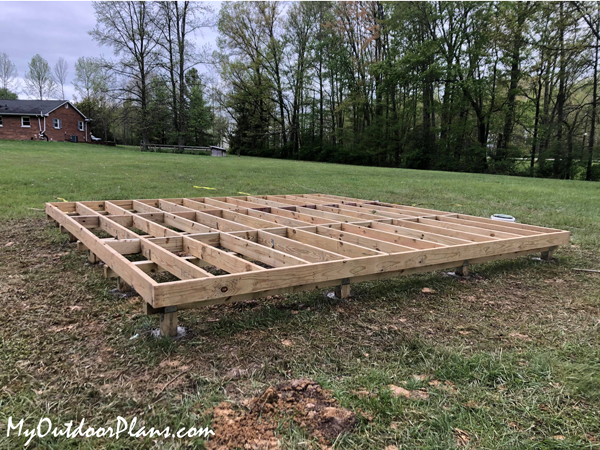
Where is `plywood legs`? plywood legs is located at coordinates (547, 254), (464, 274), (346, 294), (169, 324).